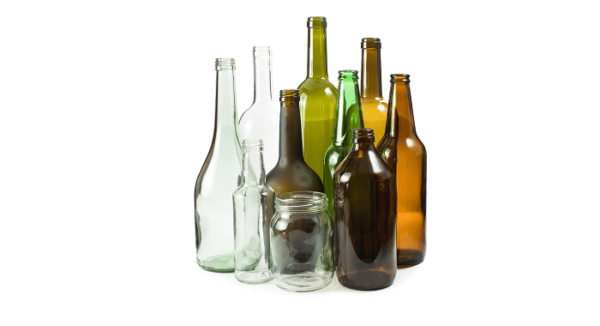
The height and width of the screenshot is (326, 600). In order to click on long necked bottles in this screenshot , I will do `click(406, 114)`, `click(371, 70)`, `click(348, 107)`, `click(318, 72)`, `click(293, 124)`, `click(265, 103)`, `click(231, 111)`, `click(255, 165)`.